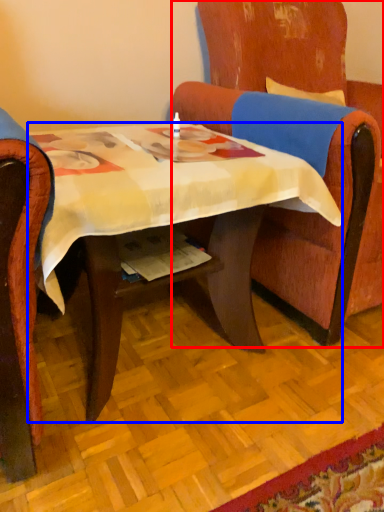
Question: Which of the following is the farthest to the observer, chair (highlighted by a red box) or desk (highlighted by a blue box)?

Choices:
 (A) chair
 (B) desk

Answer: (A)